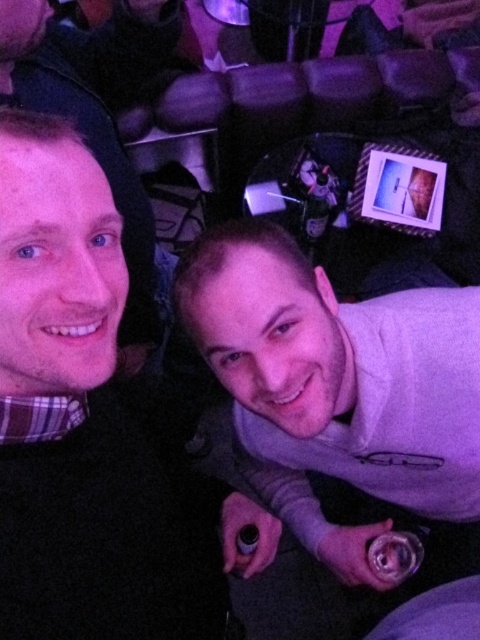
Can you confirm if matte black sweater at left is bigger than matte black shirt at left?

No, matte black sweater at left is not bigger than matte black shirt at left.

Between point (17, 134) and point (106, 122), which one is positioned in front?

Point (17, 134) is more forward.

What do you see at coordinates (78, 419) in the screenshot?
I see `matte black sweater at left` at bounding box center [78, 419].

This screenshot has width=480, height=640. I want to click on matte black sweater at left, so click(78, 419).

Is matte black sweater at left positioned in front of gray fleece sweater at center?

Yes, it is in front of gray fleece sweater at center.

What do you see at coordinates (78, 419) in the screenshot? I see `matte black sweater at left` at bounding box center [78, 419].

Which is in front, point (49, 608) or point (408, 429)?

Positioned in front is point (49, 608).

Where is `matte black sweater at left`? matte black sweater at left is located at coordinates (78, 419).

Does gray fleece sweater at center appear on the left side of matte black shirt at left?

No, gray fleece sweater at center is not to the left of matte black shirt at left.

Does gray fleece sweater at center appear over matte black shirt at left?

Incorrect, gray fleece sweater at center is not positioned above matte black shirt at left.

Identify the location of gray fleece sweater at center. (336, 385).

The height and width of the screenshot is (640, 480). What are the coordinates of `gray fleece sweater at center` in the screenshot? It's located at (336, 385).